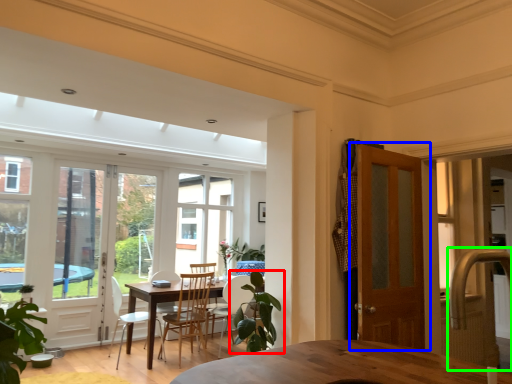
Question: Considering the real-world distances, which object is closest to houseplant (highlighted by a red box)? door (highlighted by a blue box) or faucet (highlighted by a green box).

Choices:
 (A) door
 (B) faucet

Answer: (A)